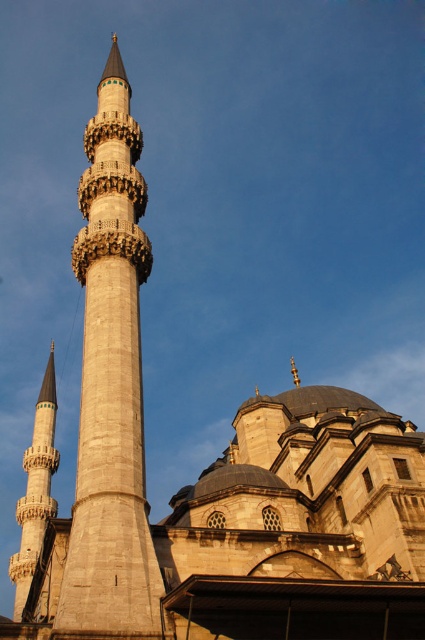
You are standing in front of the mosque and want to take a photo that includes both the light beige stone minaret at center and the smooth stone minaret at left. Which minaret should you position closer to the left side of your camera frame to include both in the photo?

The smooth stone minaret at left is already positioned to the left of the light beige stone minaret at center, so you should position the smooth stone minaret at left closer to the left side of your camera frame to include both in the photo.

You are a tourist standing in front of the mosque and want to take a photo that includes both the light beige stone minaret at center and the smooth stone minaret at left. Which minaret should you focus on to ensure both are in the frame?

The light beige stone minaret at center is much taller than the smooth stone minaret at left, so focusing on the taller one will help ensure both are in the frame.

You are standing in front of the mosque and want to take a photo that includes both the light beige stone minaret at center and the smooth stone minaret at left. Which minaret should you position closer to the camera to ensure both are in the frame?

The light beige stone minaret at center is closer to the viewer than the smooth stone minaret at left, so you should position the camera closer to the light beige stone minaret at center to ensure both are in the frame.